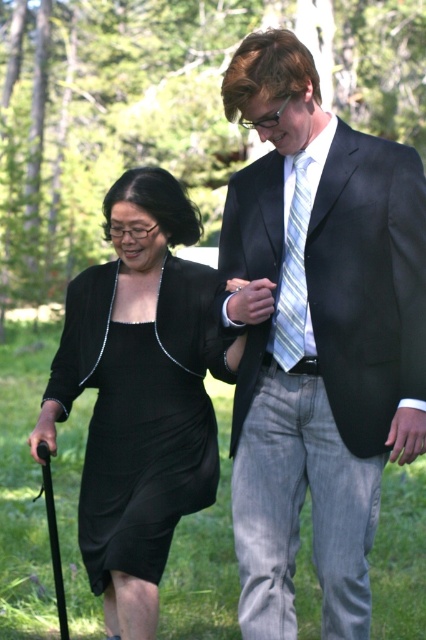
Question: Which of the following is the farthest from the observer?

Choices:
 (A) striped fabric tie at center
 (B) black satin dress at left

Answer: (B)

Question: Which point is farther to the camera?

Choices:
 (A) black satin dress at left
 (B) matte black suit at center

Answer: (A)

Question: Does black satin dress at left have a greater width compared to striped fabric tie at center?

Choices:
 (A) no
 (B) yes

Answer: (B)

Question: Which object is positioned farthest from the black satin dress at left?

Choices:
 (A) striped fabric tie at center
 (B) matte black suit at center

Answer: (A)

Question: Can you confirm if matte black suit at center is positioned to the right of striped fabric tie at center?

Choices:
 (A) no
 (B) yes

Answer: (B)

Question: Does black satin dress at left appear on the right side of striped fabric tie at center?

Choices:
 (A) no
 (B) yes

Answer: (A)